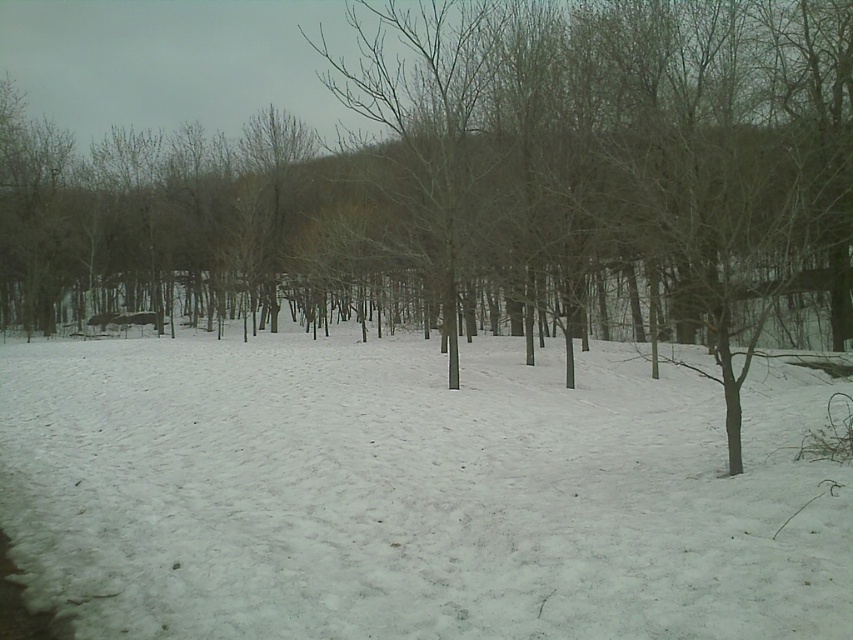
Question: Which of the following is the farthest from the observer?

Choices:
 (A) white fluffy snow at center
 (B) brown wood tree at center

Answer: (B)

Question: Can you confirm if white fluffy snow at center is thinner than brown wood tree at center?

Choices:
 (A) yes
 (B) no

Answer: (A)

Question: Is white fluffy snow at center closer to camera compared to brown wood tree at center?

Choices:
 (A) yes
 (B) no

Answer: (A)

Question: Where is white fluffy snow at center located in relation to brown wood tree at center in the image?

Choices:
 (A) left
 (B) right

Answer: (B)

Question: Which object is farther from the camera taking this photo?

Choices:
 (A) brown wood tree at center
 (B) white fluffy snow at center

Answer: (A)